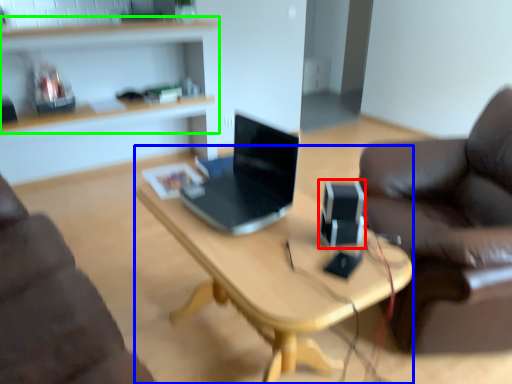
Question: Based on their relative distances, which object is farther from speaker (highlighted by a red box)? Choose from desk (highlighted by a blue box) and shelf (highlighted by a green box).

Choices:
 (A) desk
 (B) shelf

Answer: (B)